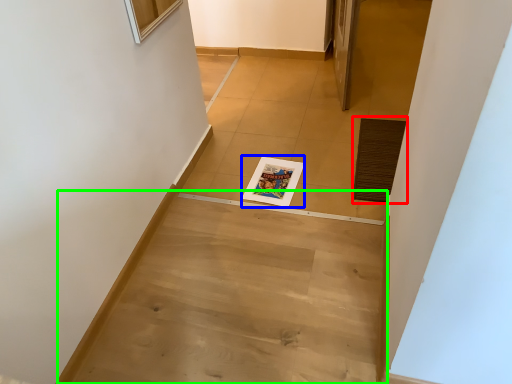
Question: Which object is positioned farthest from doormat (highlighted by a red box)? Select from magazine (highlighted by a blue box) and stairwell (highlighted by a green box).

Choices:
 (A) magazine
 (B) stairwell

Answer: (B)